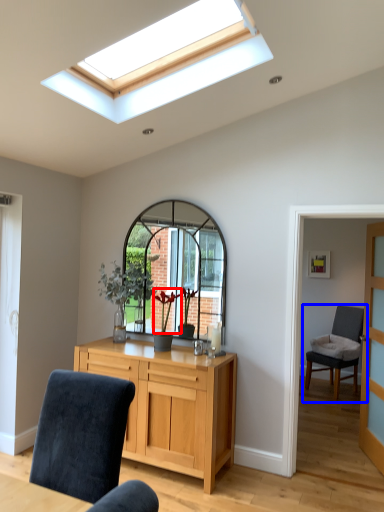
Question: Which of the following is the farthest to the observer, flower (highlighted by a red box) or chair (highlighted by a blue box)?

Choices:
 (A) flower
 (B) chair

Answer: (B)